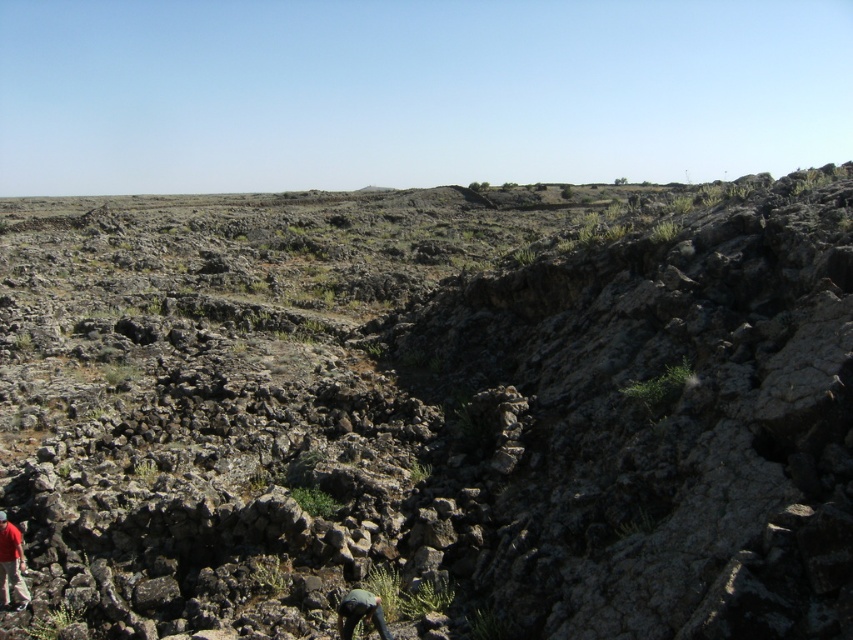
Question: Is red fabric shirt at lower left above dark gray fabric at lower center?

Choices:
 (A) yes
 (B) no

Answer: (A)

Question: Which point is farther to the camera?

Choices:
 (A) (167, 352)
 (B) (4, 518)
 (C) (350, 612)

Answer: (A)

Question: Does red fabric shirt at lower left appear over dark gray fabric at lower center?

Choices:
 (A) yes
 (B) no

Answer: (A)

Question: Which of the following is the closest to the observer?

Choices:
 (A) (386, 637)
 (B) (422, 480)

Answer: (A)

Question: Does red fabric shirt at lower left have a smaller size compared to dark gray fabric at lower center?

Choices:
 (A) no
 (B) yes

Answer: (B)

Question: Based on their relative distances, which object is nearer to the red fabric shirt at lower left?

Choices:
 (A) rocky terrain at center
 (B) dark gray fabric at lower center

Answer: (B)